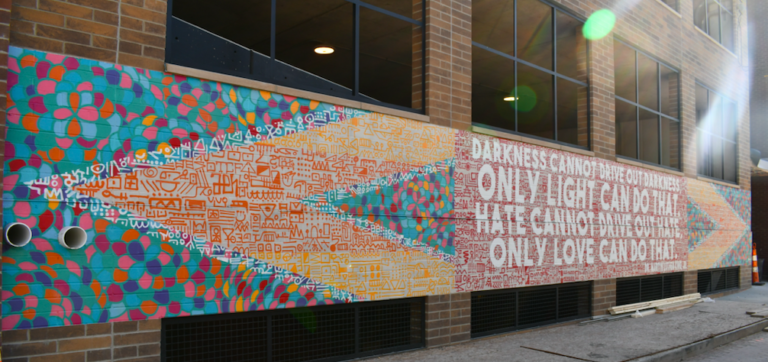
Find the location of a particular element. The image size is (768, 362). top floor right window is located at coordinates (710, 6).